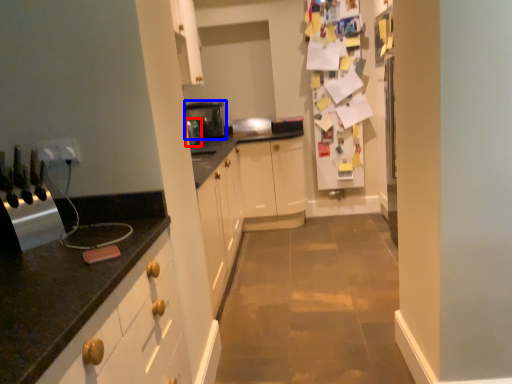
Question: Among these objects, which one is farthest to the camera, appliance (highlighted by a red box) or appliance (highlighted by a blue box)?

Choices:
 (A) appliance
 (B) appliance

Answer: (B)